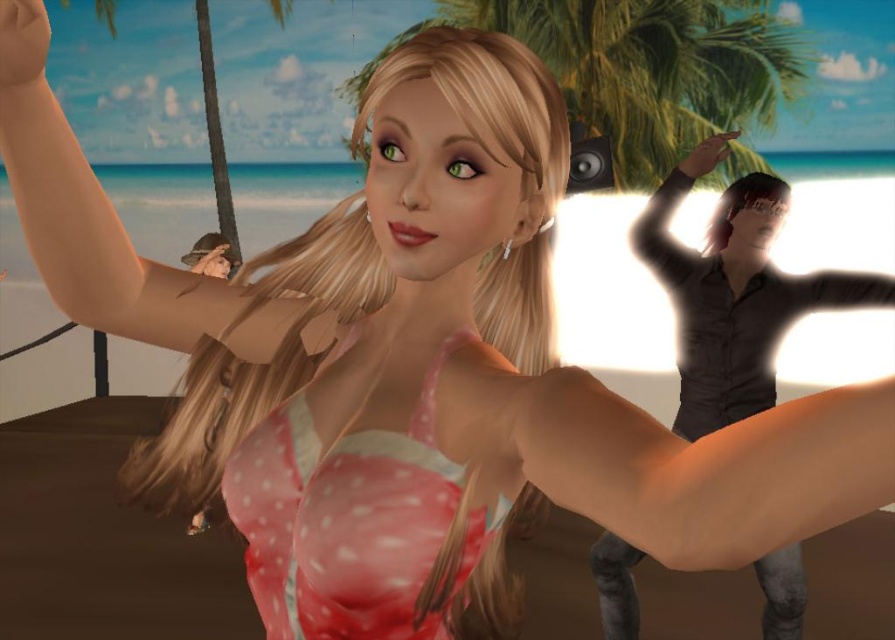
Is pink polka dot fabric dress at center below green leafy palm tree at upper center?

Indeed, pink polka dot fabric dress at center is positioned under green leafy palm tree at upper center.

Between pink polka dot fabric dress at center and green leafy palm tree at upper center, which one is positioned lower?

pink polka dot fabric dress at center is lower down.

Identify the location of pink polka dot fabric dress at center. (354, 522).